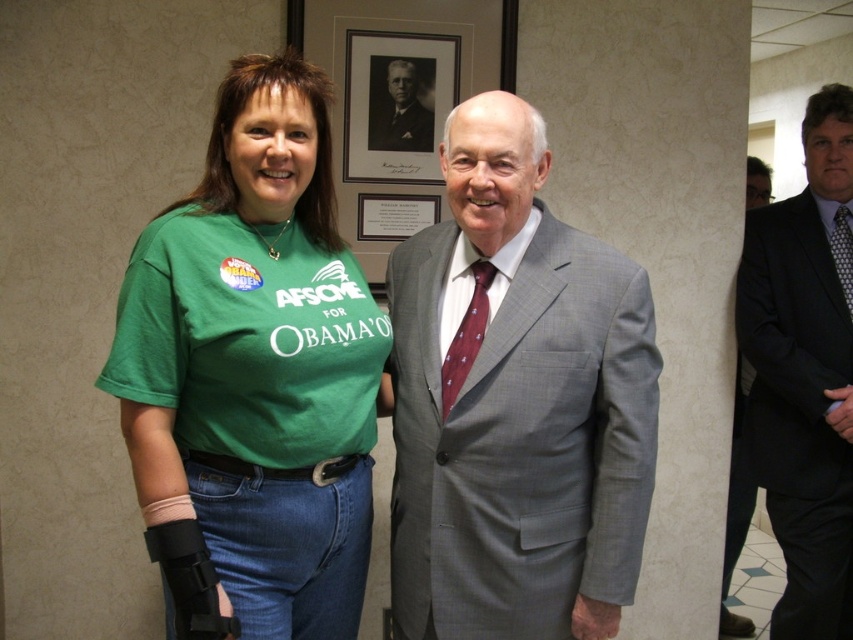
You are a photographer adjusting the camera focus. You need to focus on both the point at (325, 113) and the point at (380, 141). Which point should you focus on first to ensure both are in focus?

You should focus on point (325, 113) first because it is closer to the camera than point (380, 141), ensuring both points are within the depth of field.